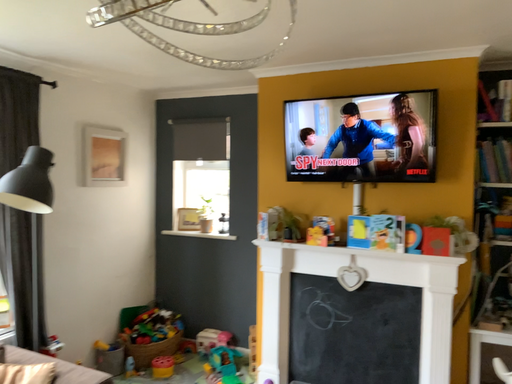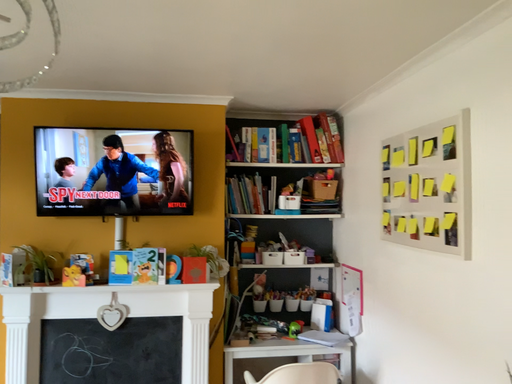
Question: How did the camera likely rotate when shooting the video?

Choices:
 (A) rotated right
 (B) rotated left

Answer: (A)